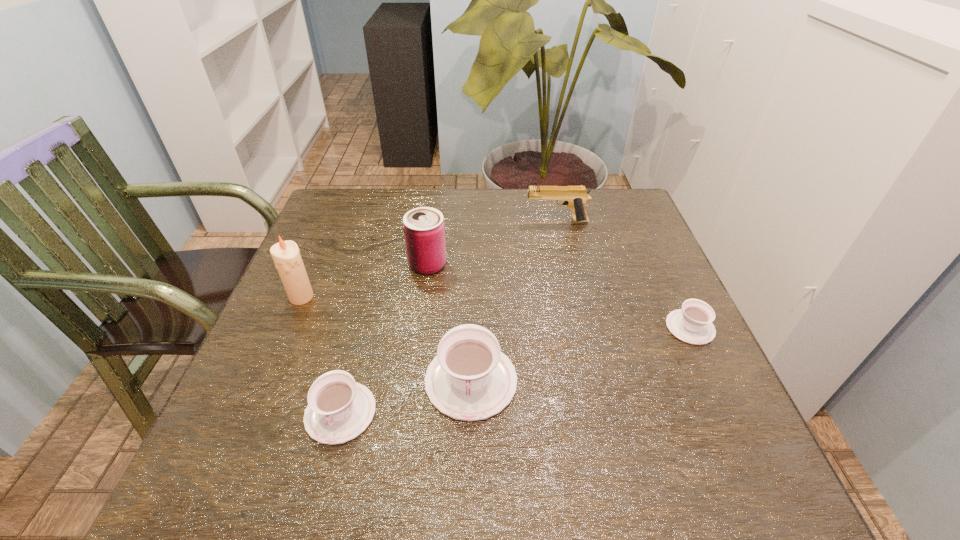
This screenshot has height=540, width=960. In order to click on the second shortest teacup in this screenshot , I will do `click(339, 409)`.

The image size is (960, 540). What are the coordinates of `the fifth object from right to left` in the screenshot? It's located at pos(339,409).

Image resolution: width=960 pixels, height=540 pixels. In order to click on the third shortest object in this screenshot , I will do `click(470, 379)`.

Image resolution: width=960 pixels, height=540 pixels. I want to click on the tallest teacup, so click(470, 379).

Where is `the shortest object`? This screenshot has width=960, height=540. the shortest object is located at coordinates (692, 324).

This screenshot has height=540, width=960. I want to click on the rightmost teacup, so click(x=692, y=324).

The height and width of the screenshot is (540, 960). Find the location of `the second farthest object`. the second farthest object is located at coordinates (424, 229).

Where is `the fifth shortest object`? The width and height of the screenshot is (960, 540). the fifth shortest object is located at coordinates (424, 229).

You are a GUI agent. You are given a task and a screenshot of the screen. Output one action in this format:
    pyautogui.click(x=<x>, y=<y>)
    Task: Click on the farthest object
    
    Given the screenshot: What is the action you would take?
    pyautogui.click(x=575, y=197)

Identify the location of pistol. This screenshot has width=960, height=540. (575, 197).